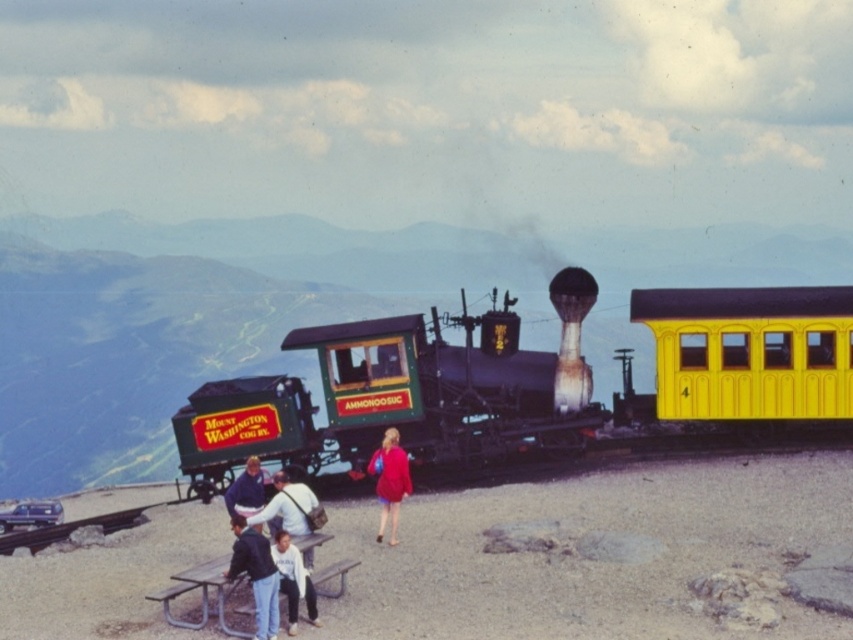
Question: Does dark blue denim jacket at lower left have a larger size compared to matte red dress at center?

Choices:
 (A) no
 (B) yes

Answer: (B)

Question: Among these objects, which one is farthest from the camera?

Choices:
 (A) green matte steam train at center
 (B) dark blue sweater at center
 (C) dark blue denim jacket at lower left

Answer: (A)

Question: Estimate the real-world distances between objects in this image. Which object is closer to the denim jacket at lower center?

Choices:
 (A) matte red dress at center
 (B) dark blue denim jacket at lower left

Answer: (B)

Question: Can you confirm if dark blue denim jacket at lower left is positioned to the right of white cotton shirt at center?

Choices:
 (A) no
 (B) yes

Answer: (A)

Question: Which object is positioned closest to the dark blue denim jacket at lower left?

Choices:
 (A) denim jacket at lower center
 (B) dark blue sweater at center

Answer: (A)

Question: Can you confirm if denim jacket at lower center is wider than white cotton shirt at center?

Choices:
 (A) yes
 (B) no

Answer: (A)